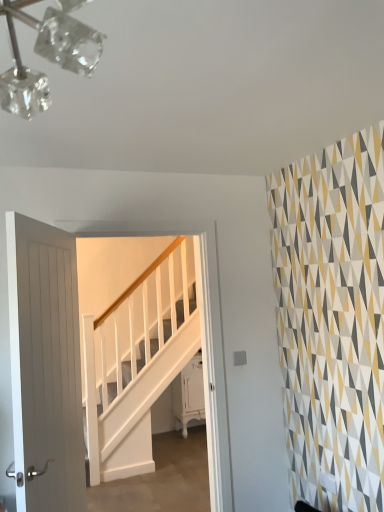
Question: Can you confirm if white wooden door at left is positioned to the left of white glossy cabinet at lower center?

Choices:
 (A) no
 (B) yes

Answer: (B)

Question: From the image's perspective, would you say white wooden door at left is shown under white glossy cabinet at lower center?

Choices:
 (A) no
 (B) yes

Answer: (A)

Question: Could you tell me if white wooden door at left is facing white glossy cabinet at lower center?

Choices:
 (A) yes
 (B) no

Answer: (B)

Question: Is white wooden door at left taller than white glossy cabinet at lower center?

Choices:
 (A) yes
 (B) no

Answer: (A)

Question: Does white wooden door at left come in front of white glossy cabinet at lower center?

Choices:
 (A) yes
 (B) no

Answer: (A)

Question: Would you say white glossy cabinet at lower center is to the left or to the right of white wooden stairs at center in the picture?

Choices:
 (A) right
 (B) left

Answer: (A)

Question: In terms of height, does white glossy cabinet at lower center look taller or shorter compared to white wooden stairs at center?

Choices:
 (A) short
 (B) tall

Answer: (A)

Question: From a real-world perspective, is white glossy cabinet at lower center physically located above or below white wooden stairs at center?

Choices:
 (A) below
 (B) above

Answer: (A)

Question: Considering their positions, is white glossy cabinet at lower center located in front of or behind white wooden stairs at center?

Choices:
 (A) front
 (B) behind

Answer: (B)

Question: From a real-world perspective, is white wooden door at left physically located above or below white wooden stairs at center?

Choices:
 (A) above
 (B) below

Answer: (A)

Question: In the image, is white wooden door at left on the left side or the right side of white wooden stairs at center?

Choices:
 (A) left
 (B) right

Answer: (A)

Question: Is white wooden door at left wider or thinner than white wooden stairs at center?

Choices:
 (A) thin
 (B) wide

Answer: (B)

Question: In terms of size, does white wooden door at left appear bigger or smaller than white wooden stairs at center?

Choices:
 (A) small
 (B) big

Answer: (A)

Question: From a real-world perspective, relative to white wooden door at left, is white glossy cabinet at lower center vertically above or below?

Choices:
 (A) above
 (B) below

Answer: (B)

Question: From the image's perspective, is white glossy cabinet at lower center above or below white wooden door at left?

Choices:
 (A) below
 (B) above

Answer: (A)